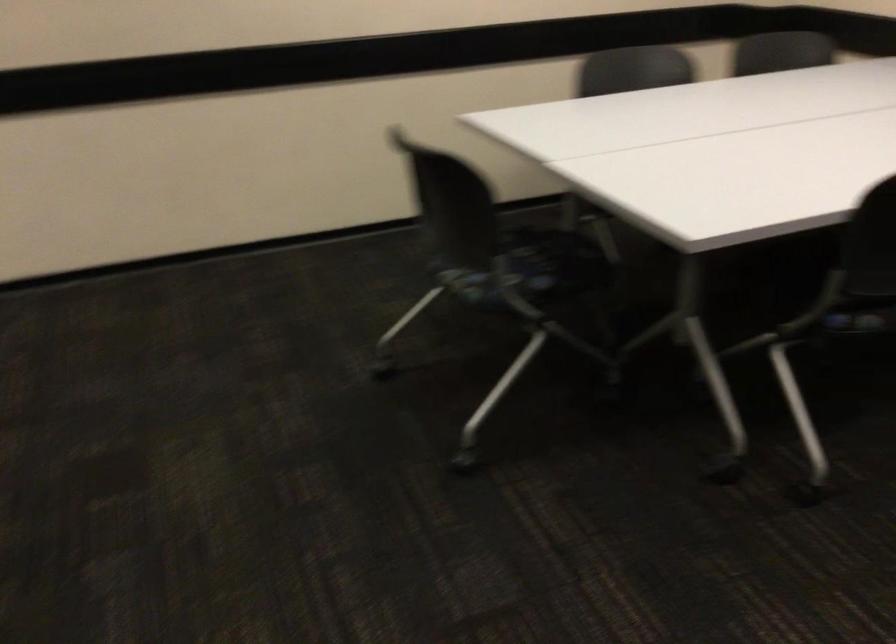
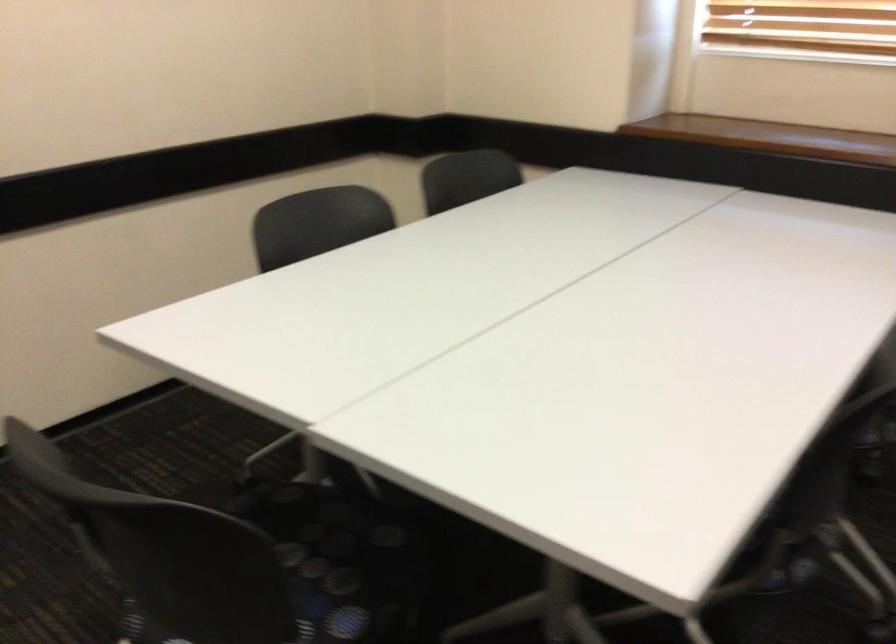
Question: The camera is either moving clockwise (left) or counter-clockwise (right) around the object. The first image is from the beginning of the video and the second image is from the end. Is the camera moving left or right when shooting the video?

Choices:
 (A) Left
 (B) Right

Answer: (A)